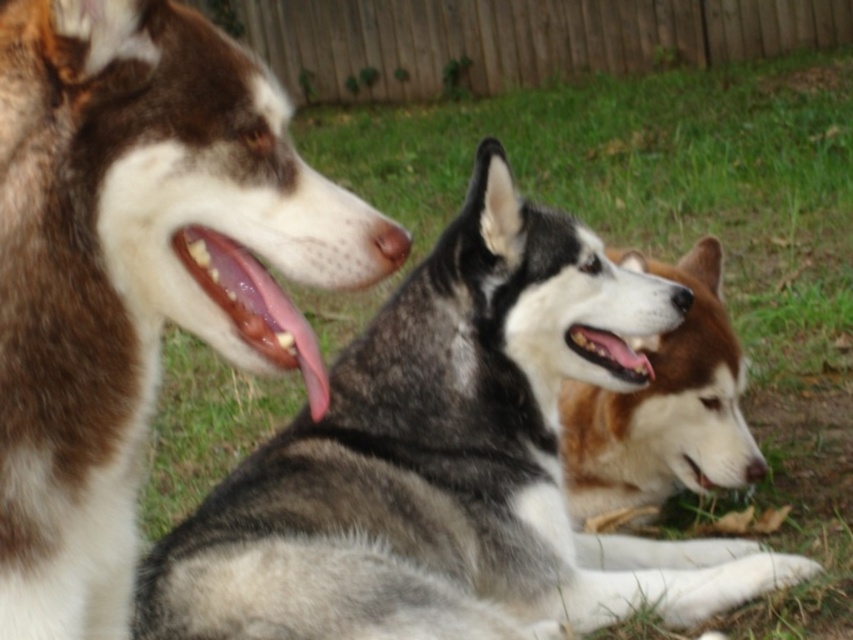
Question: Which object is closer to the camera taking this photo?

Choices:
 (A) smooth pink tongue at center
 (B) brown fur dog at center
 (C) gray fur husky at center

Answer: (A)

Question: Does brown fur dog at left come behind brown fur dog at center?

Choices:
 (A) no
 (B) yes

Answer: (A)

Question: Considering the relative positions of brown fur dog at left and smooth pink tongue at center in the image provided, where is brown fur dog at left located with respect to smooth pink tongue at center?

Choices:
 (A) below
 (B) above

Answer: (A)

Question: Which object is the farthest from the gray fur husky at center?

Choices:
 (A) smooth pink tongue at center
 (B) pink glossy tongue at center

Answer: (A)

Question: Is brown fur dog at left positioned before pink glossy tongue at center?

Choices:
 (A) no
 (B) yes

Answer: (B)

Question: Which object appears farthest from the camera in this image?

Choices:
 (A) brown fur dog at center
 (B) brown fur dog at left
 (C) smooth pink tongue at center
 (D) gray fur husky at center

Answer: (A)